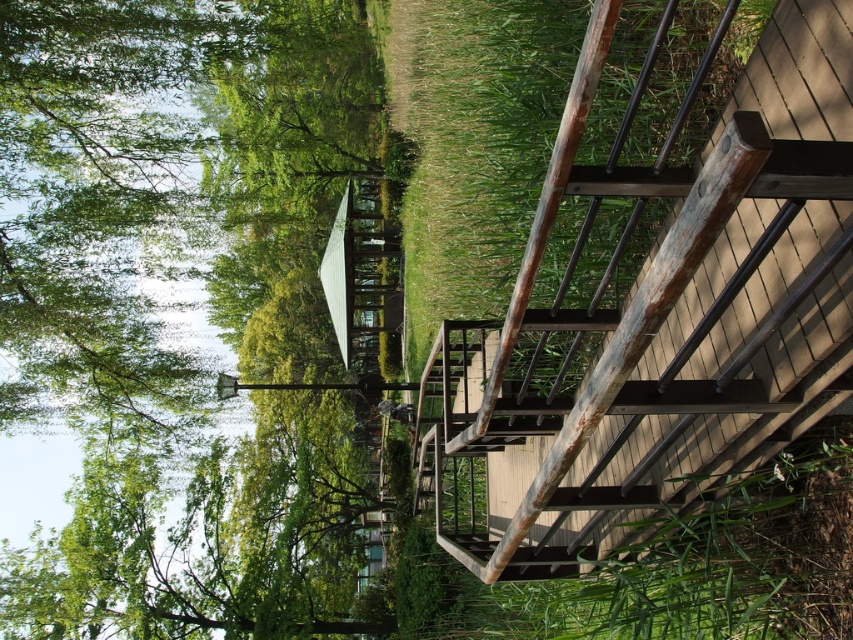
You are standing at the entrance of the walkway and want to take a photo of the green leafy tree at upper left. Which direction should you face to ensure the tree is in the frame?

The green leafy tree at upper left is located at point coordinates, so you should face towards the upper left direction to capture it in your photo.